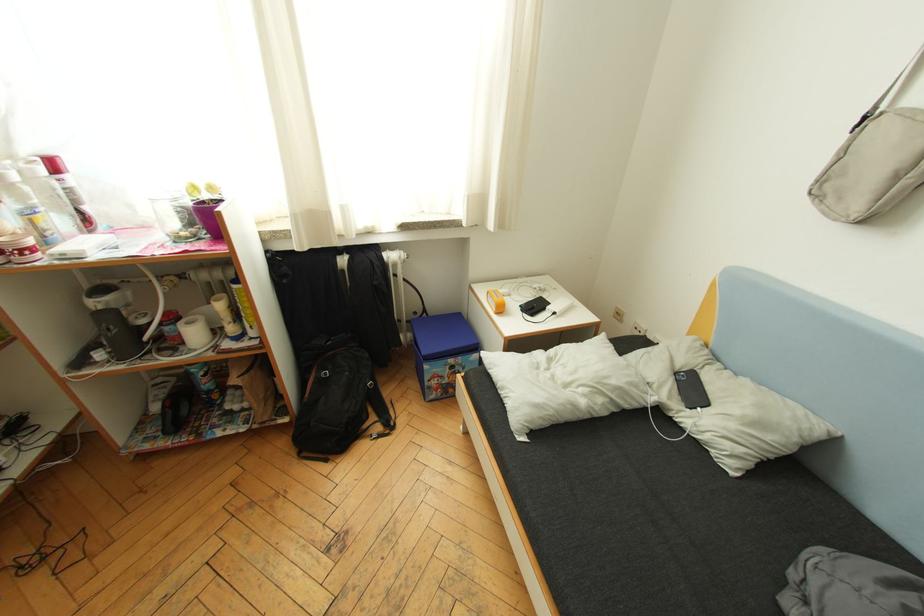
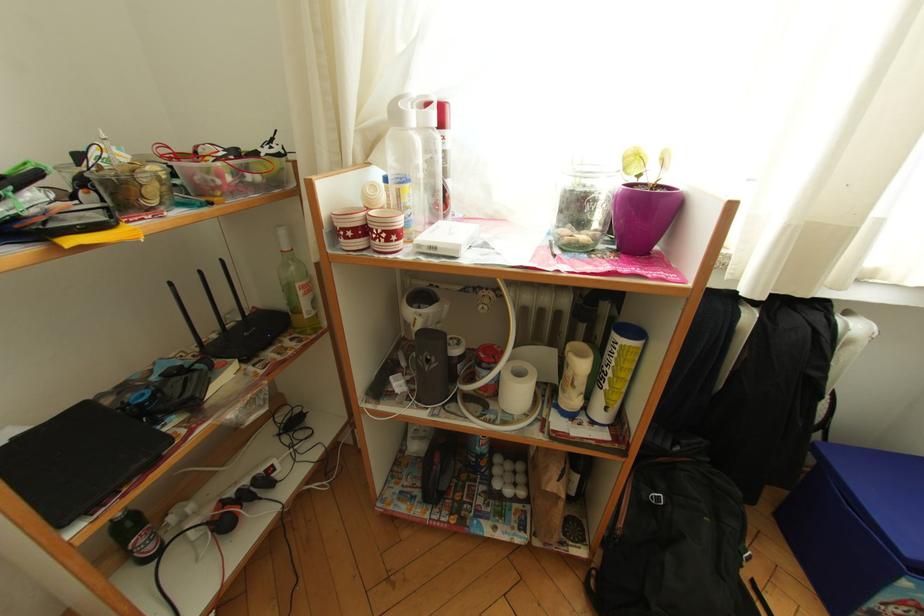
What movement of the cameraman would produce the second image?

The cameraman moved toward left, forward.